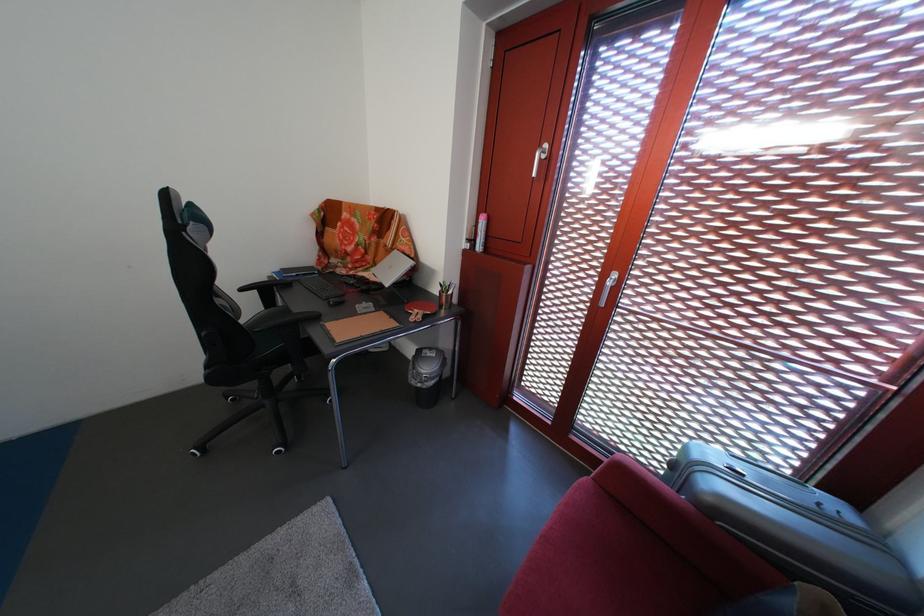
I want to click on silver door handle, so click(608, 286).